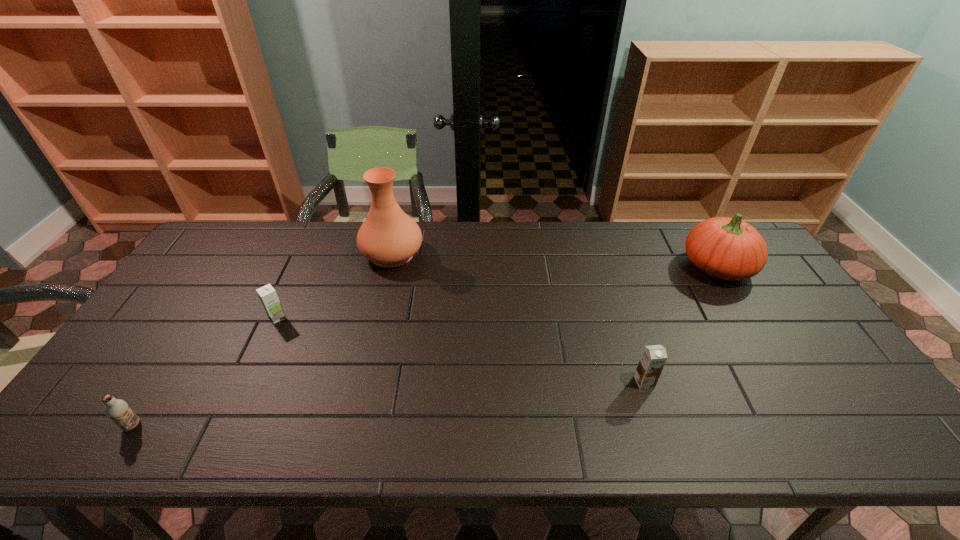
Identify the location of object present at the near left corner. (117, 410).

Where is `object that is at the far right corner`? object that is at the far right corner is located at coordinates (727, 248).

This screenshot has height=540, width=960. In the image, there is a desktop. What are the coordinates of `vacant space at the far edge` in the screenshot? It's located at (676, 264).

The height and width of the screenshot is (540, 960). Find the location of `vacant region at the near edge of the desktop`. vacant region at the near edge of the desktop is located at coordinates (618, 437).

Locate an element on the screen. Image resolution: width=960 pixels, height=540 pixels. vacant position at the left edge of the desktop is located at coordinates (174, 288).

In order to click on free point at the right edge in this screenshot , I will do `click(797, 392)`.

Find the location of `vacant position at the far left corner of the desktop`. vacant position at the far left corner of the desktop is located at coordinates (233, 241).

You are a GUI agent. You are given a task and a screenshot of the screen. Output one action in this format:
    pyautogui.click(x=<x>, y=<y>)
    Task: Click on the vacant area between the pumpkin and the tallest object
    This screenshot has width=960, height=540.
    Given the screenshot: What is the action you would take?
    pyautogui.click(x=555, y=260)

The height and width of the screenshot is (540, 960). I want to click on free space between the second farthest chocolate milk and the nearest chocolate milk, so click(x=388, y=403).

I want to click on vacant space that's between the third nearest object and the rightmost object, so click(x=497, y=292).